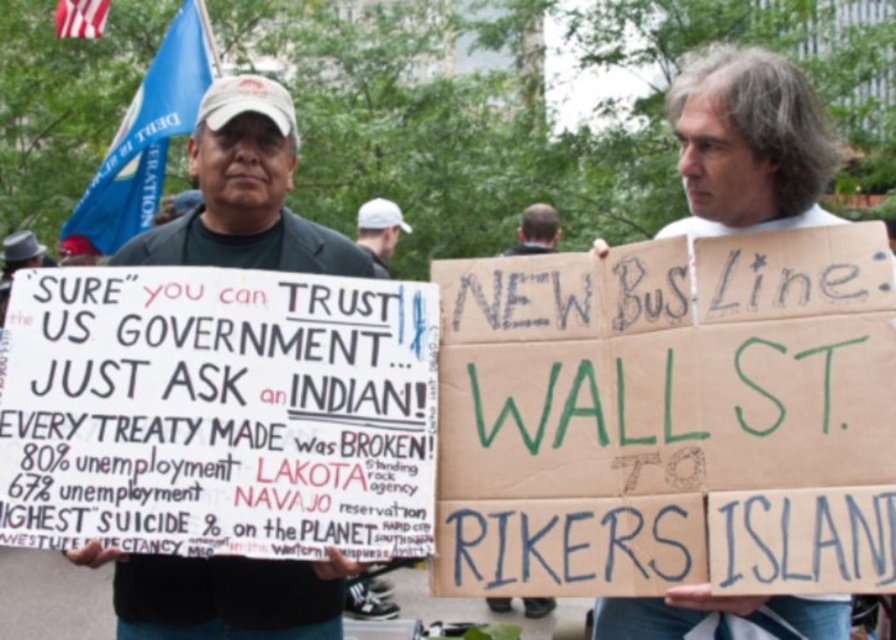
You are a photographer standing in the protest scene. You want to capture a photo where both the white cardboard sign at center and the white matte baseball cap at center are visible. Based on their positions, will the sign block the view of the cap in the photo?

The white cardboard sign at center is above the white matte baseball cap at center, so the sign will block the view of the cap in the photo.